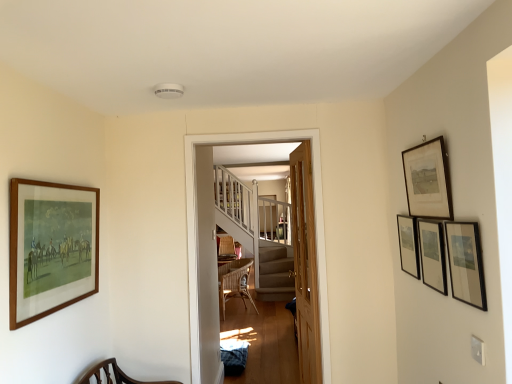
Question: From the image's perspective, is matte black picture frame at right, which is the 5th picture frame from left to right, above or below light brown wooden door at center?

Choices:
 (A) below
 (B) above

Answer: (B)

Question: In terms of size, does matte black picture frame at right, the first picture frame in the right-to-left sequence, appear bigger or smaller than light brown wooden door at center?

Choices:
 (A) big
 (B) small

Answer: (B)

Question: Considering the real-world distances, which object is closest to the black matte picture frame at upper right, the 3th picture frame viewed from the left?

Choices:
 (A) light brown wooden door at center
 (B) wooden-framed painting at left, the 5th picture frame viewed from the right
 (C) wooden framed print at upper right, the 4th picture frame viewed from the right
 (D) matte black picture frame at right, which is the 5th picture frame from left to right
 (E) matte black picture frame at right, positioned as the fourth picture frame in left-to-right order

Answer: (D)

Question: Considering the real-world distances, which object is closest to the wooden-framed painting at left, the 5th picture frame viewed from the right?

Choices:
 (A) wooden staircase at center
 (B) light brown wooden door at center
 (C) woven rattan chair at center
 (D) wooden framed print at upper right, the 4th picture frame viewed from the right
 (E) matte black picture frame at right, positioned as the fourth picture frame in left-to-right order

Answer: (A)